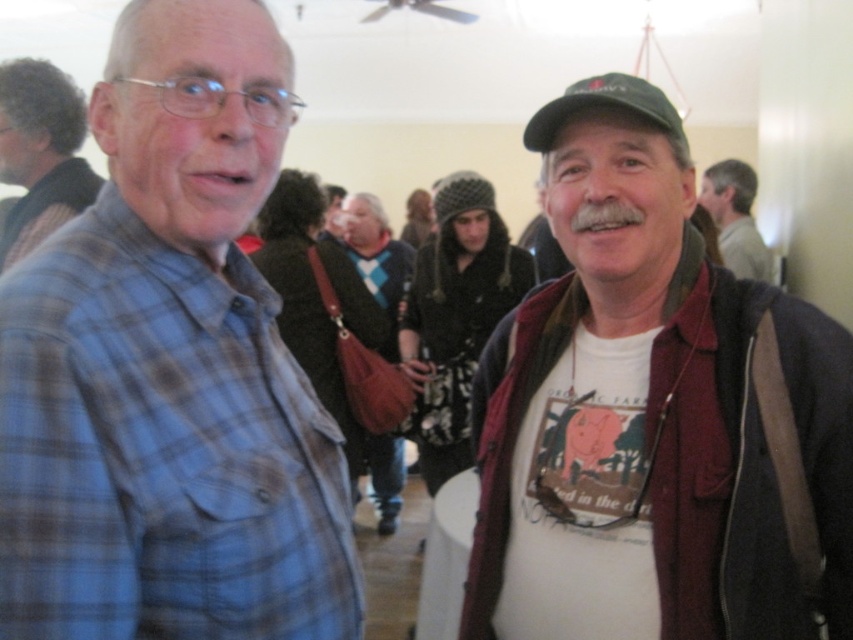
You are standing in the room where the two people are talking. You want to walk to the point that is closer to the ceiling fan. Which point should you go to, point [367,285] or point [370,225]?

Point [367,285] is in front of point [370,225], so it is closer to the ceiling fan at the top center. Therefore, you should go to point [367,285].

You are a photographer at this event and need to ensure both the blue plaid shirt at left and the gray plaid shirt at left are clearly visible in the photo. Which one should you focus on to capture both effectively?

You should focus on the blue plaid shirt at left because it is in front of the gray plaid shirt at left, ensuring both are visible when focused on the closer subject.